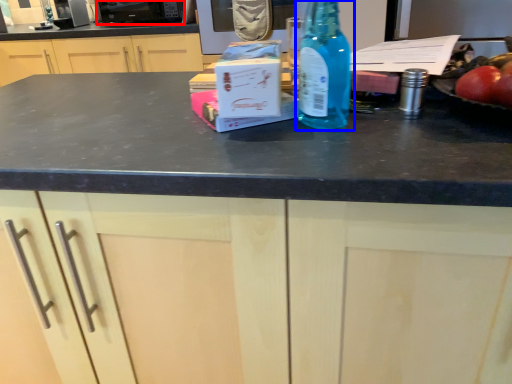
Question: Among these objects, which one is farthest to the camera, appliance (highlighted by a red box) or bottle (highlighted by a blue box)?

Choices:
 (A) appliance
 (B) bottle

Answer: (A)